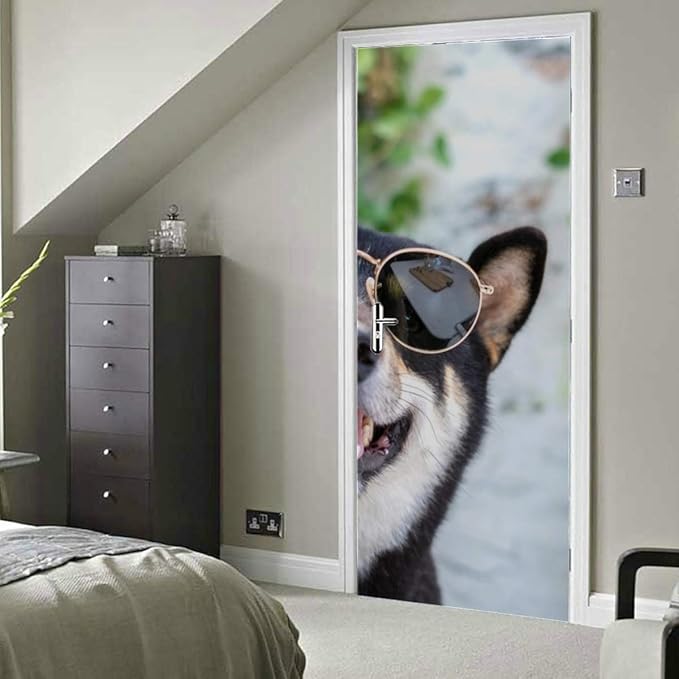
Locate an element on the screen. This screenshot has width=679, height=679. tan carpet is located at coordinates (278, 587), (339, 629), (496, 644).